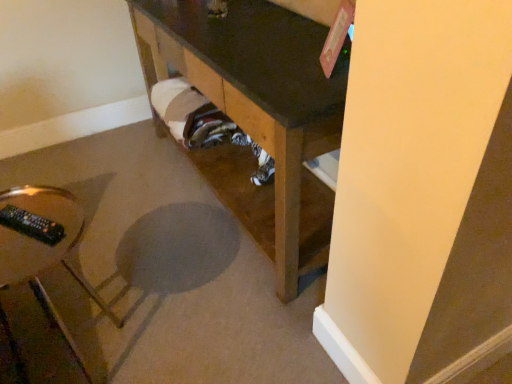
The width and height of the screenshot is (512, 384). Find the location of `vacant space behind clear glass remote control at lower left, arranged as the 2th furniture when viewed from the right`. vacant space behind clear glass remote control at lower left, arranged as the 2th furniture when viewed from the right is located at coordinates (133, 278).